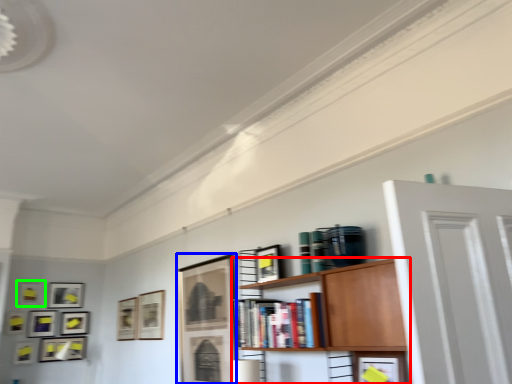
Question: Considering the real-world distances, which object is closest to shelf (highlighted by a red box)? picture frame (highlighted by a blue box) or picture frame (highlighted by a green box).

Choices:
 (A) picture frame
 (B) picture frame

Answer: (A)